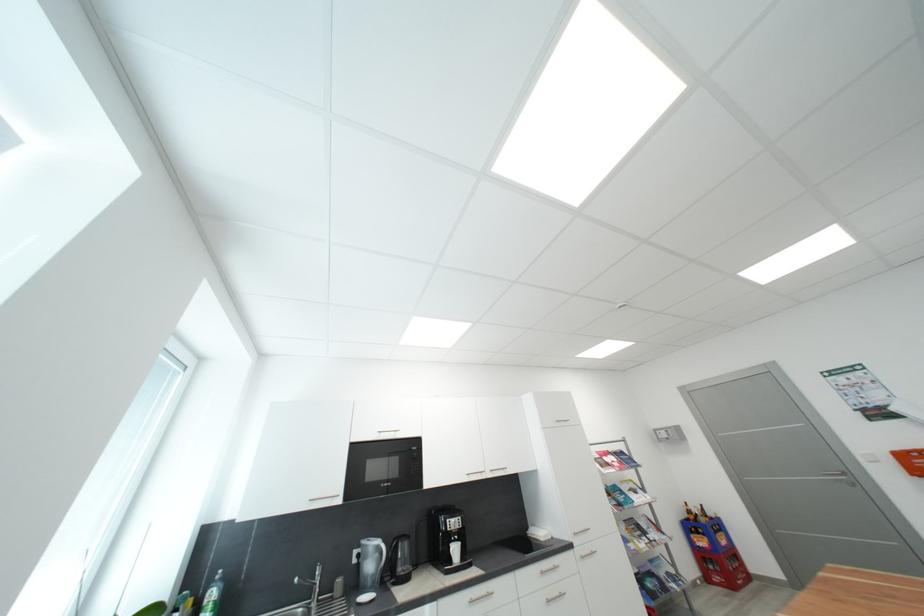
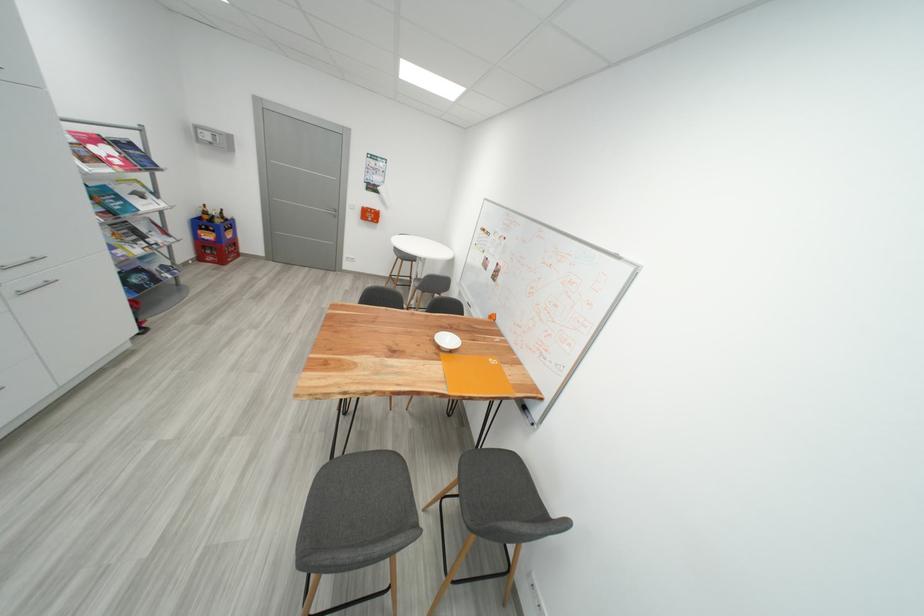
The point at (703, 513) is marked in the first image. Where is the corresponding point in the second image?

(220, 214)